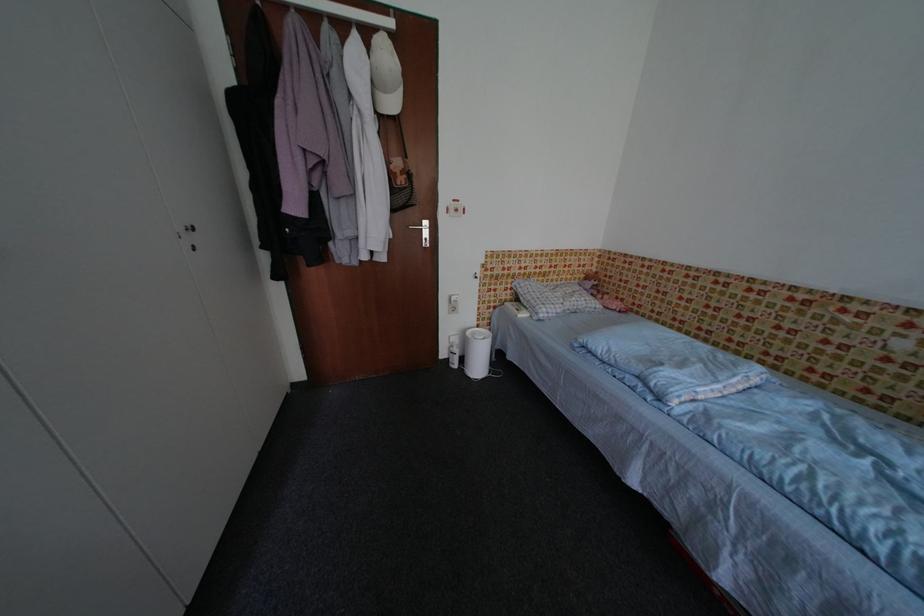
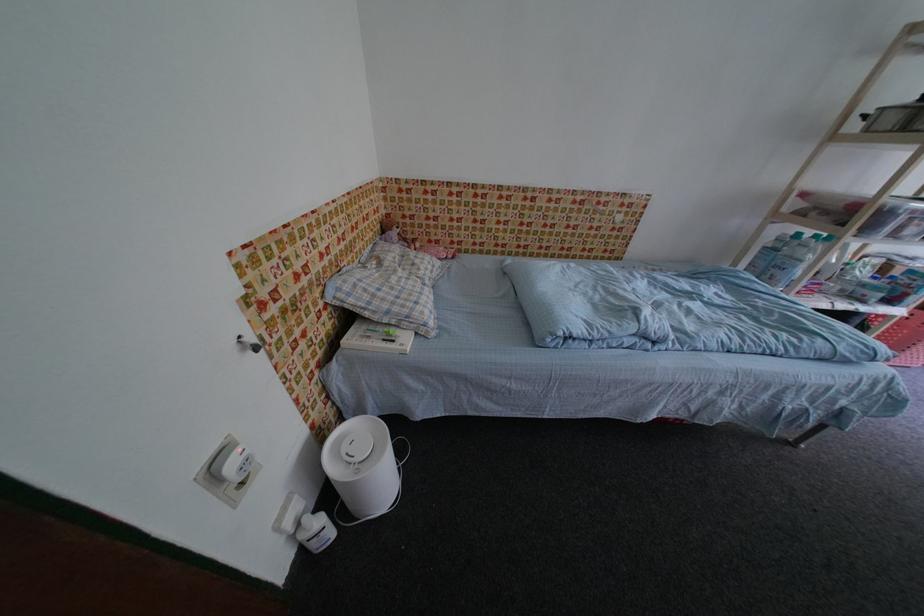
Find the pixel in the second image that matches pixel 487 371 in the first image.

(391, 485)